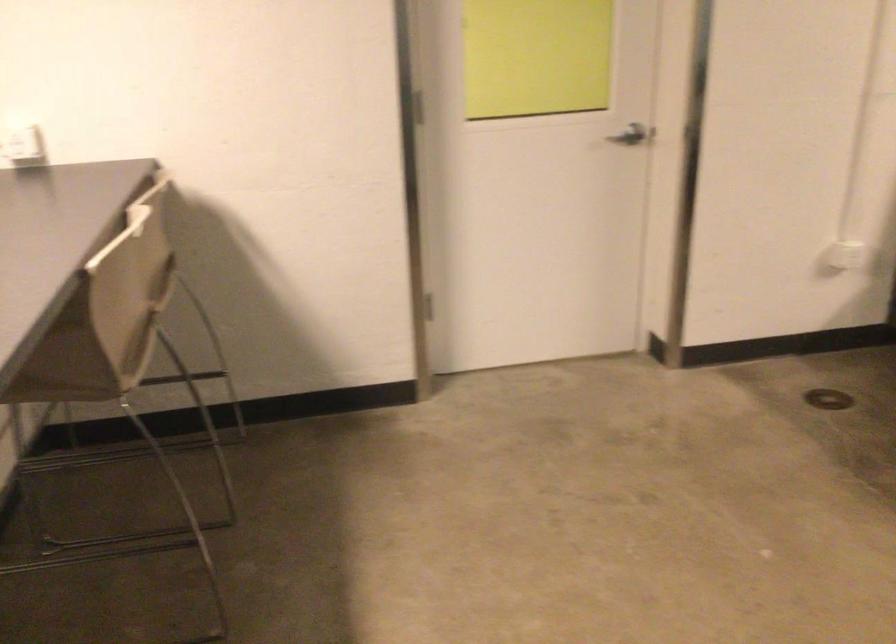
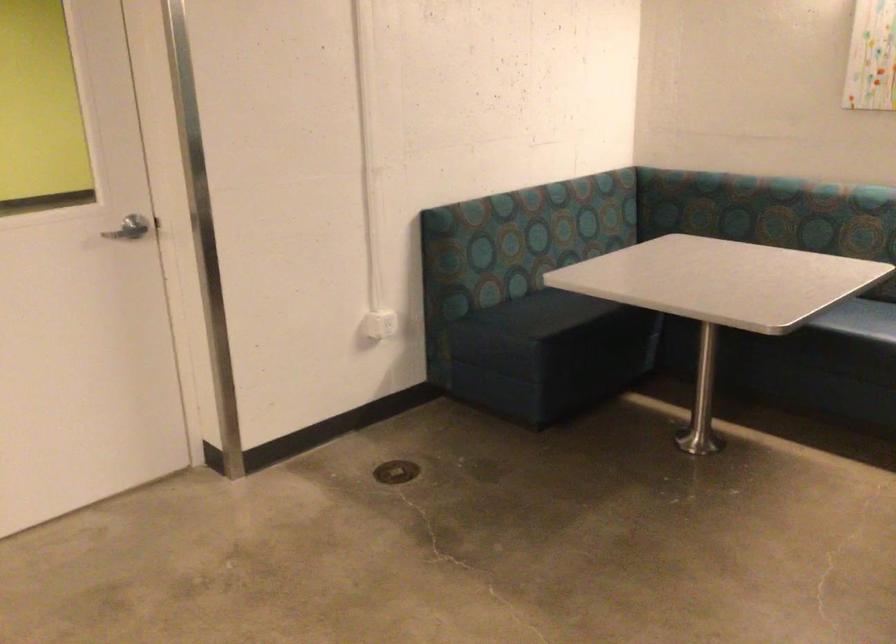
Question: The camera is either moving clockwise (left) or counter-clockwise (right) around the object. The first image is from the beginning of the video and the second image is from the end. Is the camera moving left or right when shooting the video?

Choices:
 (A) Left
 (B) Right

Answer: (A)